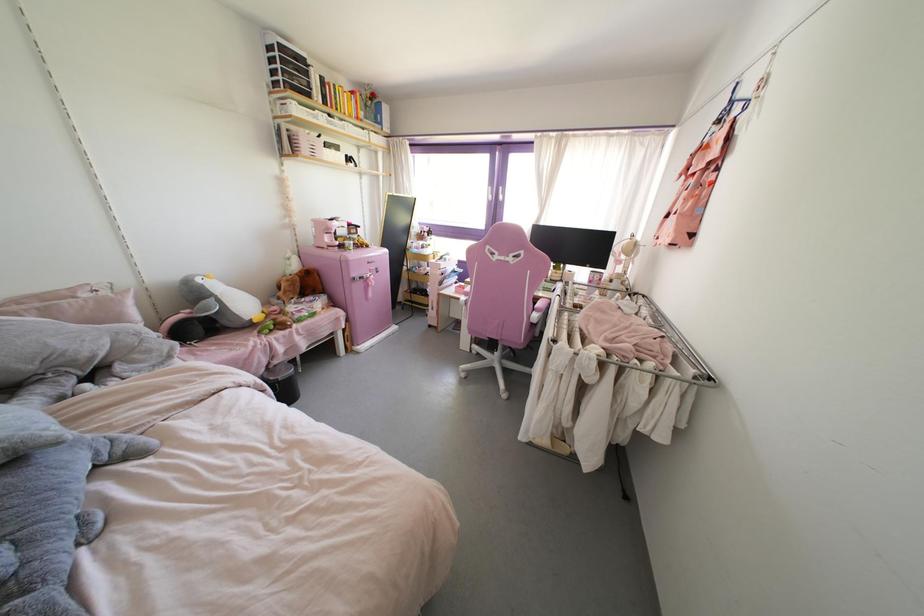
You are a GUI agent. You are given a task and a screenshot of the screen. Output one action in this format:
    pyautogui.click(x=<x>, y=<y>)
    Task: Click on the penguin stuffed animal
    
    Given the screenshot: What is the action you would take?
    pyautogui.click(x=220, y=301)